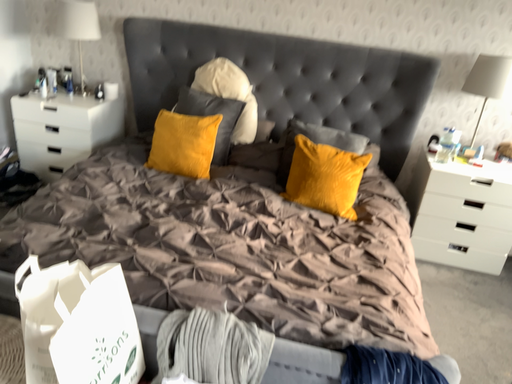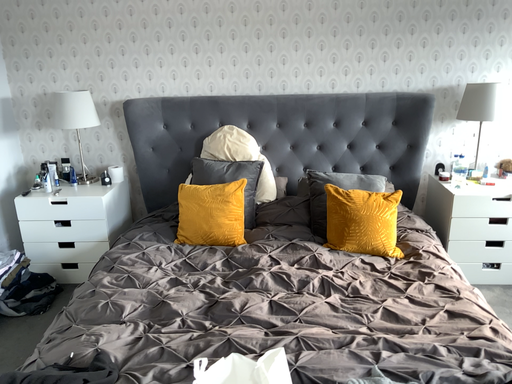
Question: How did the camera likely rotate when shooting the video?

Choices:
 (A) rotated upward
 (B) rotated downward

Answer: (A)